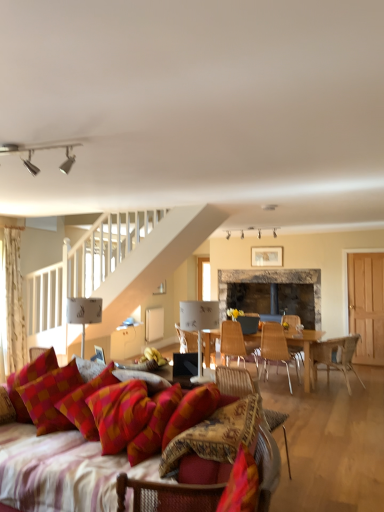
Question: Can you confirm if wooden chair at center, the 6th chair positioned from the front, is positioned to the right of textured woven chair at lower left, the sixth chair when ordered from back to front?

Choices:
 (A) no
 (B) yes

Answer: (B)

Question: From the image's perspective, is wooden chair at center, the 6th chair positioned from the front, on textured woven chair at lower left, the first chair viewed from the front?

Choices:
 (A) no
 (B) yes

Answer: (A)

Question: Considering the relative positions of wooden chair at center, the 6th chair positioned from the front, and textured woven chair at lower left, the sixth chair when ordered from back to front, in the image provided, is wooden chair at center, the 6th chair positioned from the front, in front of textured woven chair at lower left, the sixth chair when ordered from back to front,?

Choices:
 (A) no
 (B) yes

Answer: (A)

Question: Is wooden chair at center, the 6th chair positioned from the front, not inside textured woven chair at lower left, the first chair viewed from the front?

Choices:
 (A) yes
 (B) no

Answer: (A)

Question: Is wooden chair at center, which ranks as the first chair in back-to-front order, wider than textured woven chair at lower left, the sixth chair when ordered from back to front?

Choices:
 (A) yes
 (B) no

Answer: (B)

Question: Could you tell me if wooden chair at center, the 6th chair positioned from the front, is turned towards textured woven chair at lower left, the first chair viewed from the front?

Choices:
 (A) yes
 (B) no

Answer: (A)

Question: Is wooden chair at center, the 6th chair positioned from the front, not close to silver metallic track lights at upper center, placed as the 3th lamp when sorted from back to front?

Choices:
 (A) yes
 (B) no

Answer: (A)

Question: Is the position of wooden chair at center, which ranks as the first chair in back-to-front order, less distant than that of silver metallic track lights at upper center, the second lamp viewed from the left?

Choices:
 (A) yes
 (B) no

Answer: (B)

Question: Does wooden chair at center, which ranks as the first chair in back-to-front order, lie behind silver metallic track lights at upper center, the third lamp from the bottom?

Choices:
 (A) no
 (B) yes

Answer: (B)

Question: From a real-world perspective, is wooden chair at center, the 6th chair positioned from the front, physically below silver metallic track lights at upper center, placed as the 3th lamp when sorted from back to front?

Choices:
 (A) yes
 (B) no

Answer: (A)

Question: Is wooden chair at center, the 6th chair positioned from the front, at the right side of silver metallic track lights at upper center, the 2th lamp viewed from the right?

Choices:
 (A) no
 (B) yes

Answer: (B)

Question: Is wooden chair at center, the 6th chair positioned from the front, located outside silver metallic track lights at upper center, placed as the 3th lamp when sorted from back to front?

Choices:
 (A) no
 (B) yes

Answer: (B)

Question: Can you confirm if silver metallic track lights at upper center, placed as the 3th lamp when sorted from back to front, is bigger than wooden chair at right, which appears as the 4th chair when viewed from the back?

Choices:
 (A) no
 (B) yes

Answer: (A)